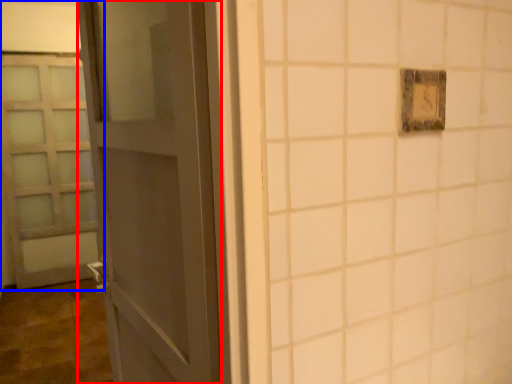
Question: Which of the following is the closest to the observer, door (highlighted by a red box) or door (highlighted by a blue box)?

Choices:
 (A) door
 (B) door

Answer: (A)